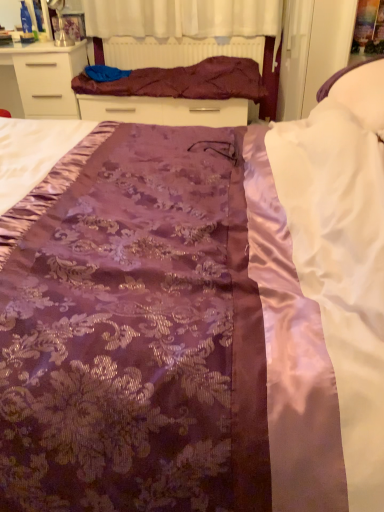
Where is `free space above purple satin bed frame at upper center (from a real-world perspective)`? Image resolution: width=384 pixels, height=512 pixels. free space above purple satin bed frame at upper center (from a real-world perspective) is located at coordinates (185, 34).